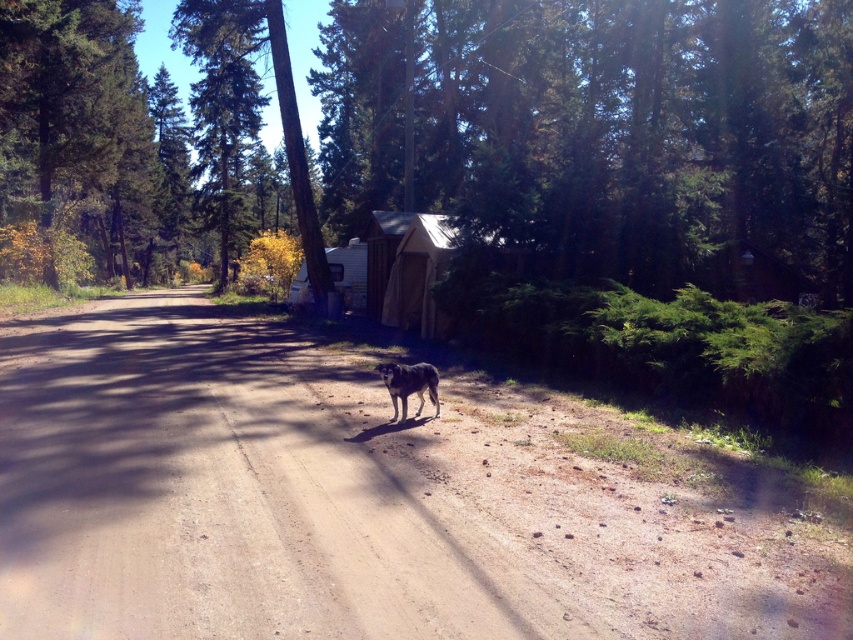
Can you confirm if green leafy tree at center is taller than white canvas cabin at center?

Yes, green leafy tree at center is taller than white canvas cabin at center.

From the picture: Is green leafy tree at center positioned before white canvas cabin at center?

Yes, green leafy tree at center is in front of white canvas cabin at center.

Is point (815, 24) positioned after point (357, 282)?

No, (815, 24) is in front of (357, 282).

This screenshot has width=853, height=640. What are the coordinates of `green leafy tree at center` in the screenshot? It's located at (602, 129).

Based on the photo, can you confirm if brown dirt track at center is smaller than green leafy tree at center?

Correct, brown dirt track at center occupies less space than green leafy tree at center.

Is brown dirt track at center thinner than green leafy tree at center?

Correct, brown dirt track at center's width is less than green leafy tree at center's.

This screenshot has height=640, width=853. Describe the element at coordinates (355, 500) in the screenshot. I see `brown dirt track at center` at that location.

You are a GUI agent. You are given a task and a screenshot of the screen. Output one action in this format:
    pyautogui.click(x=<x>, y=<y>)
    Task: Click on the brown dirt track at center
    The image size is (853, 640).
    Given the screenshot: What is the action you would take?
    pyautogui.click(x=355, y=500)

Between green leafy tree at center and fuzzy brown dog at center, which one appears on the right side from the viewer's perspective?

Positioned to the right is fuzzy brown dog at center.

Which of these two, green leafy tree at center or fuzzy brown dog at center, stands shorter?

Standing shorter between the two is fuzzy brown dog at center.

Between point (438, 100) and point (405, 404), which one is positioned behind?

The point (438, 100) is behind.

Where is `green leafy tree at center`? The height and width of the screenshot is (640, 853). green leafy tree at center is located at coordinates (602, 129).